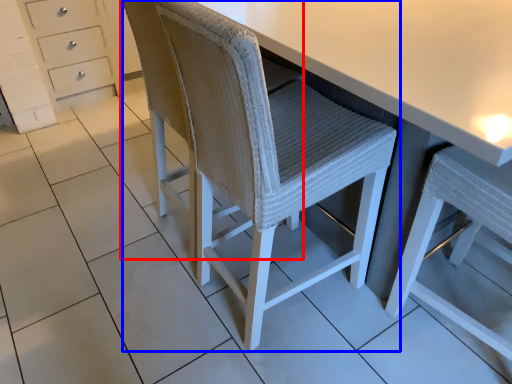
Question: Among these objects, which one is farthest to the camera, swivel chair (highlighted by a red box) or chair (highlighted by a blue box)?

Choices:
 (A) swivel chair
 (B) chair

Answer: (A)